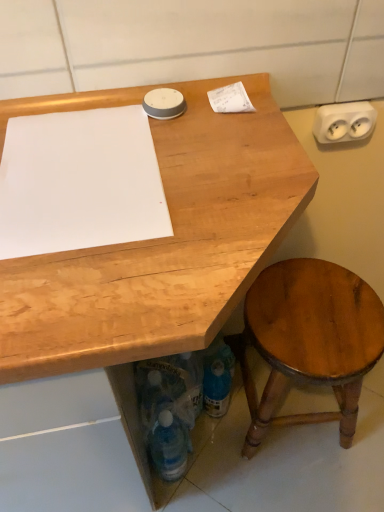
Identify the location of vacant region to the right of white paper at upper left, which is the second notepad from right to left. The image size is (384, 512). (225, 167).